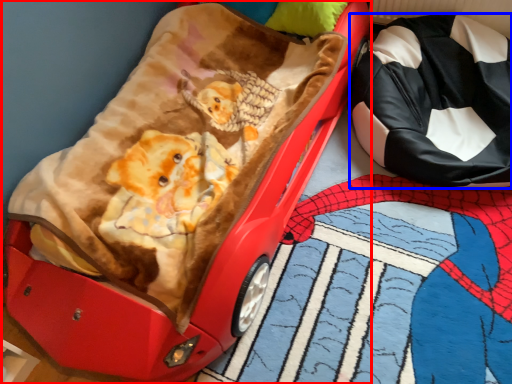
Question: Which object appears closest to the camera in this image, furniture (highlighted by a red box) or pillow (highlighted by a blue box)?

Choices:
 (A) furniture
 (B) pillow

Answer: (A)